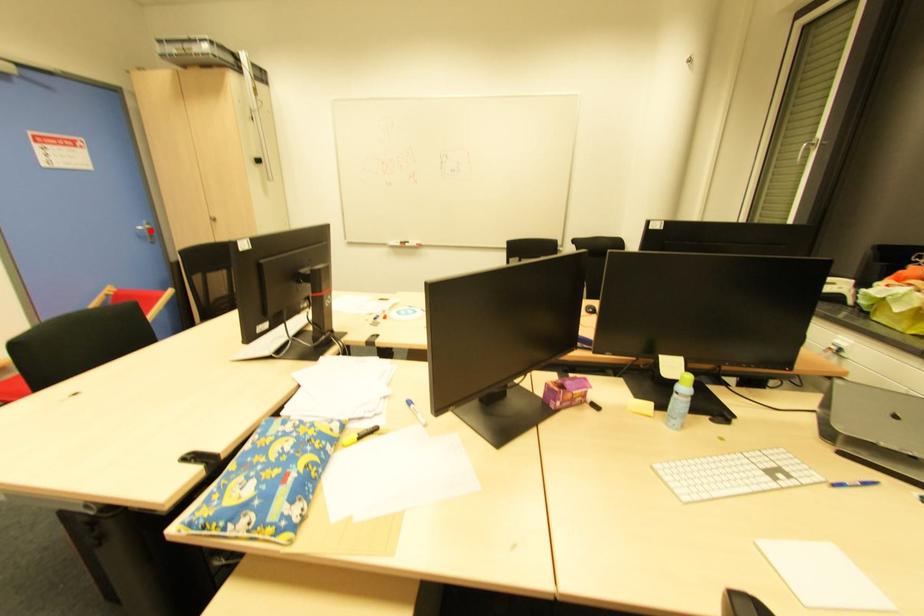
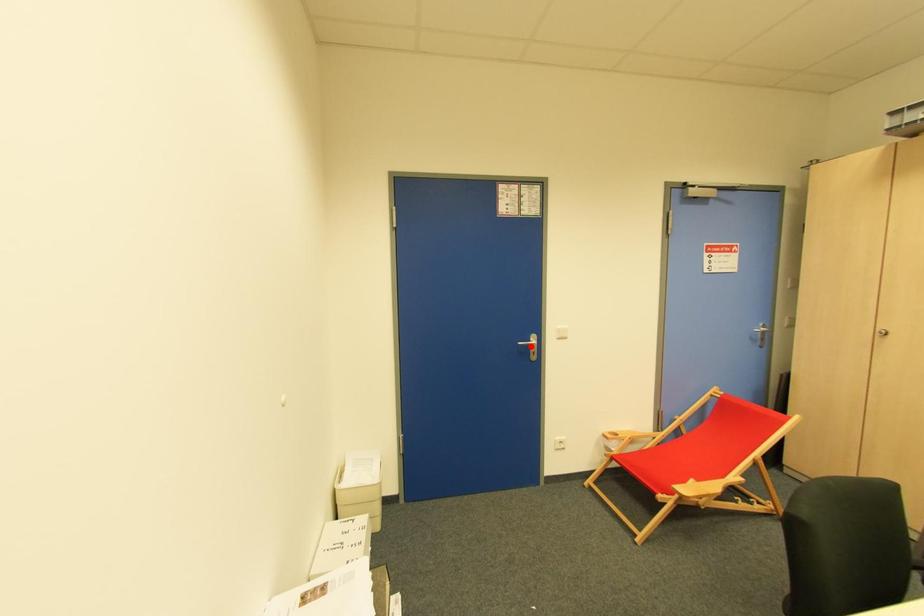
I am providing you with two images of the same scene from different viewpoints. A red point is marked on the first image and another point is marked on the second image. Are the points marked in image1 and image2 representing the same 3D position?

No